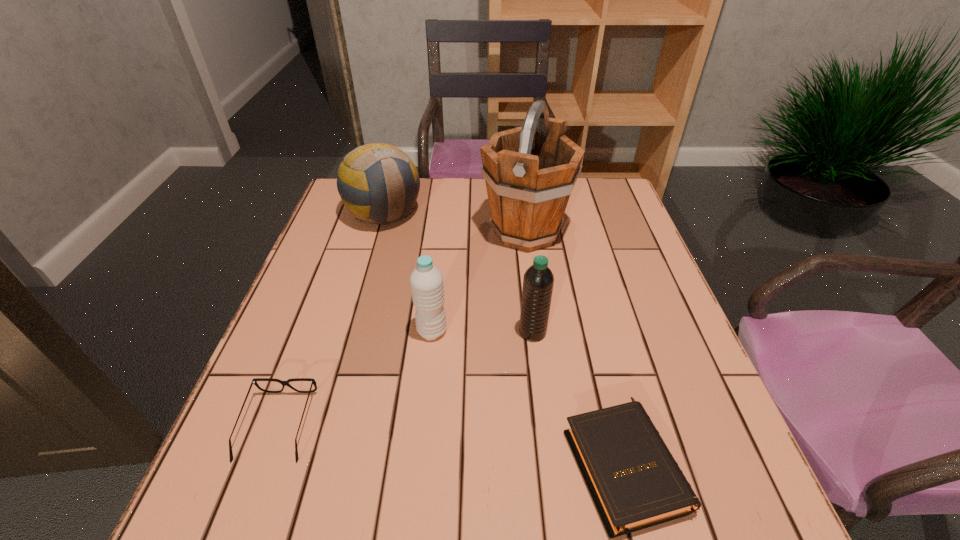
The height and width of the screenshot is (540, 960). Identify the location of vacant position in the image that satisfies the following two spatial constraints: 1. with the lenses facing outward on the spectacles; 2. on the right side of the Bible. (264, 464).

Locate an element on the screen. free spot that satisfies the following two spatial constraints: 1. on the back side of the third object from left to right; 2. on the left side of the tallest object is located at coordinates (443, 232).